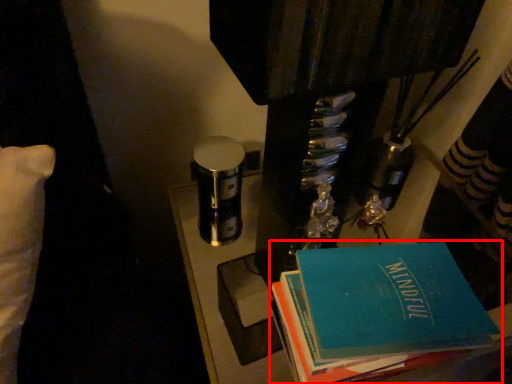
Question: From the image's perspective, where is book (annotated by the red box) located relative to table?

Choices:
 (A) above
 (B) below

Answer: (A)